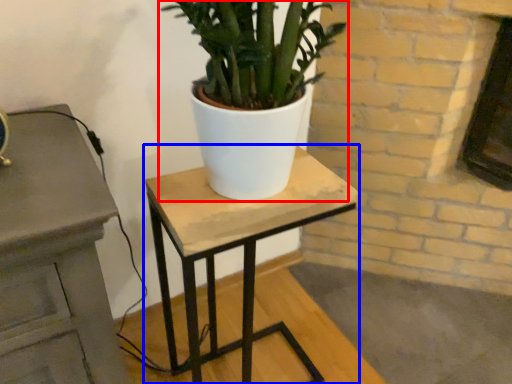
Question: Which of the following is the farthest to the observer, houseplant (highlighted by a red box) or table (highlighted by a blue box)?

Choices:
 (A) houseplant
 (B) table

Answer: (B)